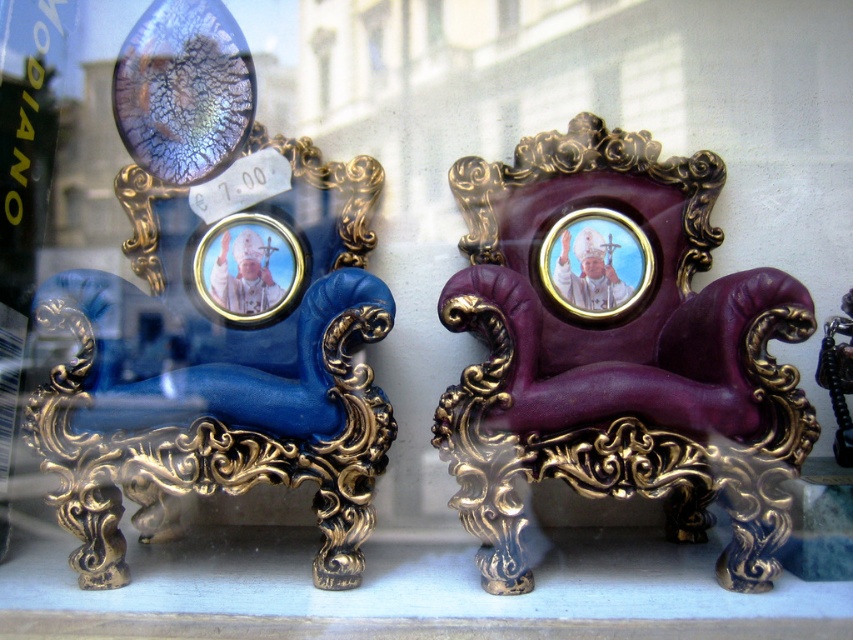
The width and height of the screenshot is (853, 640). What do you see at coordinates (618, 352) in the screenshot?
I see `purple leather armchair at center` at bounding box center [618, 352].

Who is higher up, purple leather armchair at center or gold metallic picture frame at center?

Positioned higher is gold metallic picture frame at center.

Who is more forward, (653, 220) or (271, 244)?

Point (271, 244) is more forward.

The height and width of the screenshot is (640, 853). I want to click on purple leather armchair at center, so click(618, 352).

Can you confirm if purple leather armchair at center is thinner than gold-framed picture at center?

In fact, purple leather armchair at center might be wider than gold-framed picture at center.

Does purple leather armchair at center have a greater width compared to gold-framed picture at center?

Yes, purple leather armchair at center is wider than gold-framed picture at center.

The height and width of the screenshot is (640, 853). What are the coordinates of `purple leather armchair at center` in the screenshot? It's located at (618, 352).

Who is positioned more to the left, gold-framed picture at center or gold metallic picture frame at center?

From the viewer's perspective, gold metallic picture frame at center appears more on the left side.

Which is above, gold-framed picture at center or gold metallic picture frame at center?

gold-framed picture at center is above.

Is point (560, 232) closer to camera compared to point (212, 225)?

No.

I want to click on gold-framed picture at center, so click(595, 262).